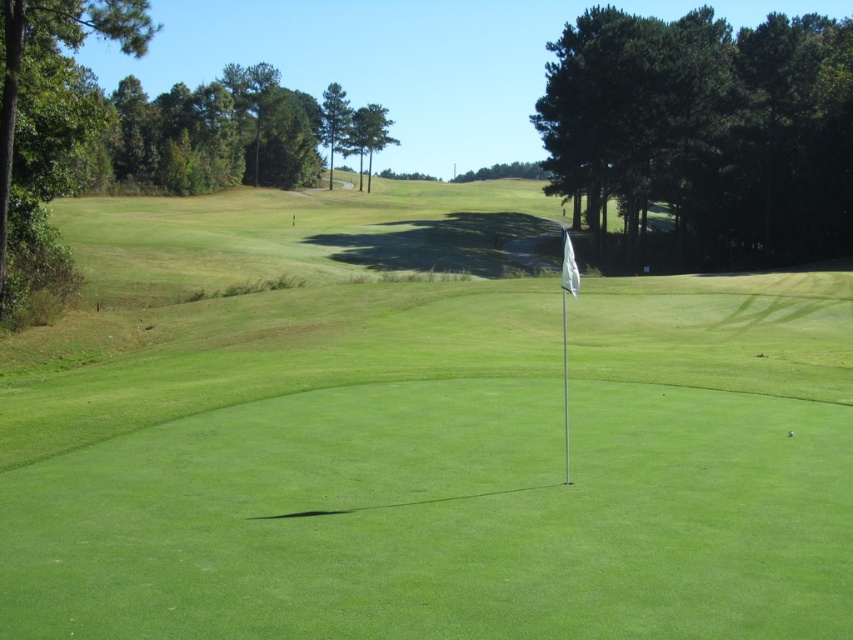
You are a golfer standing at the tee and see the green grass flag at center and the green matte golf ball at center. Which object is positioned to the left of the other?

The green grass flag at center is to the left of the green matte golf ball at center.

You are a golfer standing at the tee box and want to hit your ball towards the green grass flag at center. Based on the coordinates provided, in which direction should you aim your shot?

You should aim your shot towards the coordinates point (416,433) where the green grass flag at center is located.